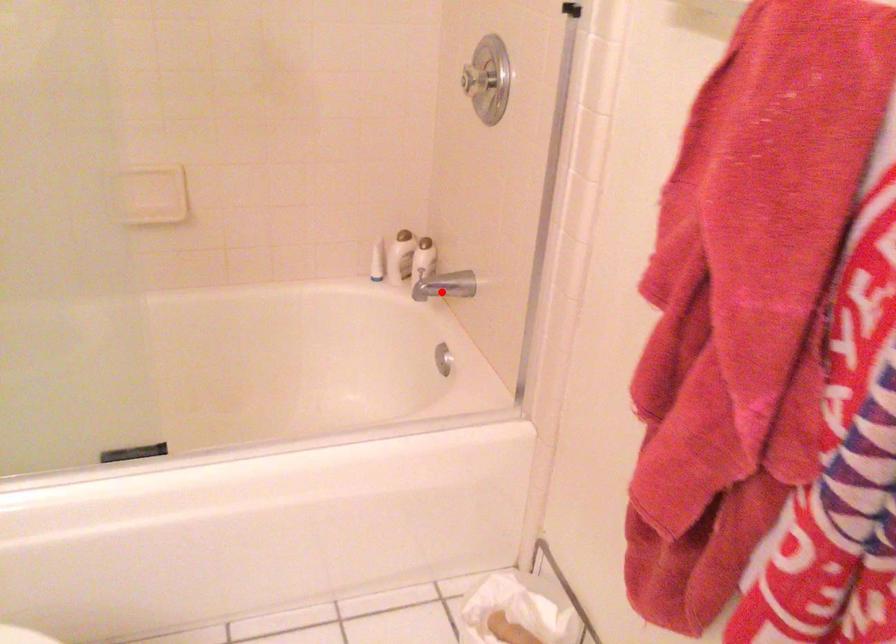
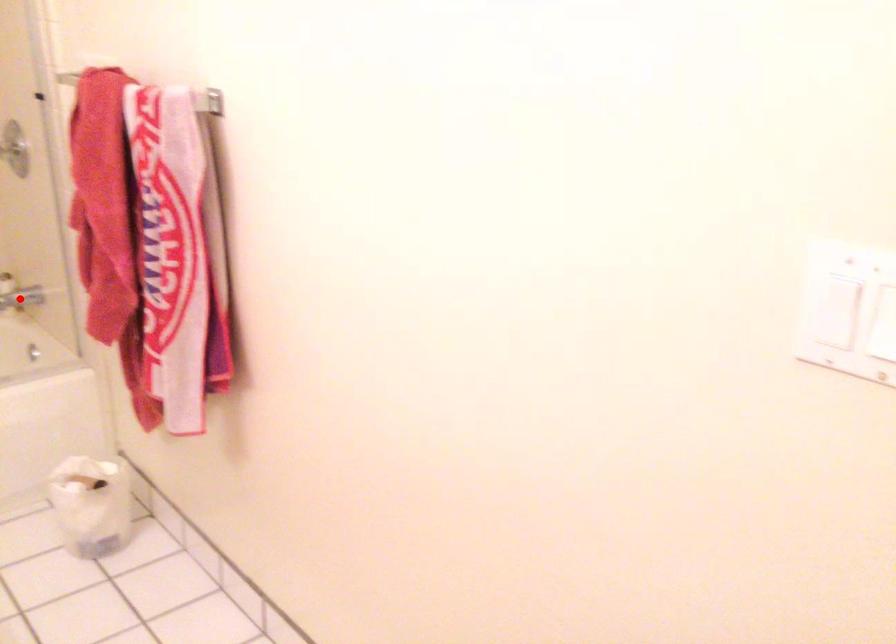
I am providing you with two images of the same scene from different viewpoints. A red point is marked on the first image and another point is marked on the second image. Do the highlighted points in image1 and image2 indicate the same real-world spot?

Yes